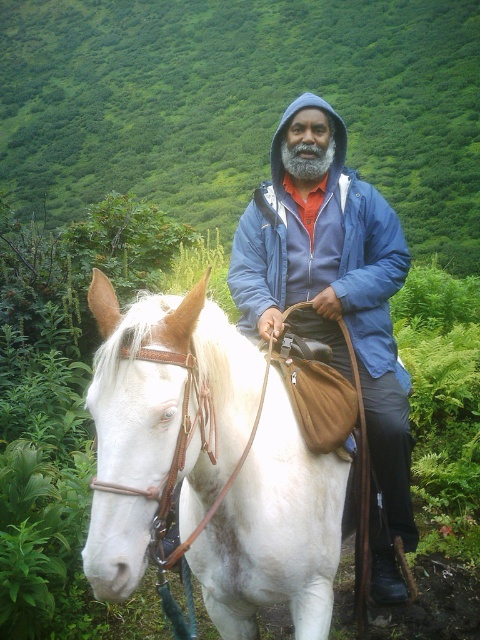
Question: Estimate the real-world distances between objects in this image. Which object is closer to the white leather horse at center?

Choices:
 (A) green leafy hillside at upper center
 (B) blue fleece jacket at center

Answer: (B)

Question: Can you confirm if green leafy hillside at upper center is thinner than white leather horse at center?

Choices:
 (A) yes
 (B) no

Answer: (B)

Question: Does green leafy hillside at upper center have a lesser width compared to white leather horse at center?

Choices:
 (A) yes
 (B) no

Answer: (B)

Question: Estimate the real-world distances between objects in this image. Which object is closer to the green leafy hillside at upper center?

Choices:
 (A) white leather horse at center
 (B) blue fleece jacket at center

Answer: (A)

Question: Is green leafy hillside at upper center to the left of white leather horse at center from the viewer's perspective?

Choices:
 (A) yes
 (B) no

Answer: (A)

Question: Estimate the real-world distances between objects in this image. Which object is farther from the green leafy hillside at upper center?

Choices:
 (A) blue fleece jacket at center
 (B) white leather horse at center

Answer: (A)